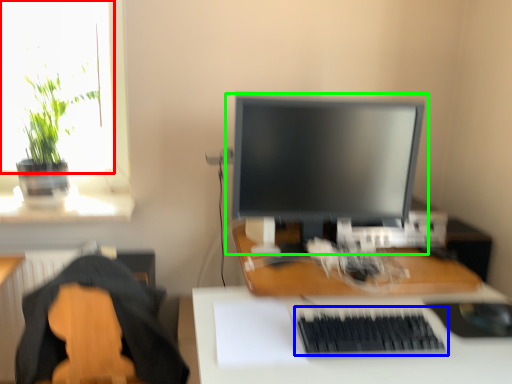
Question: Which object is the closest to the window screen (highlighted by a red box)? Choose among these: computer keyboard (highlighted by a blue box) or computer monitor (highlighted by a green box).

Choices:
 (A) computer keyboard
 (B) computer monitor

Answer: (B)